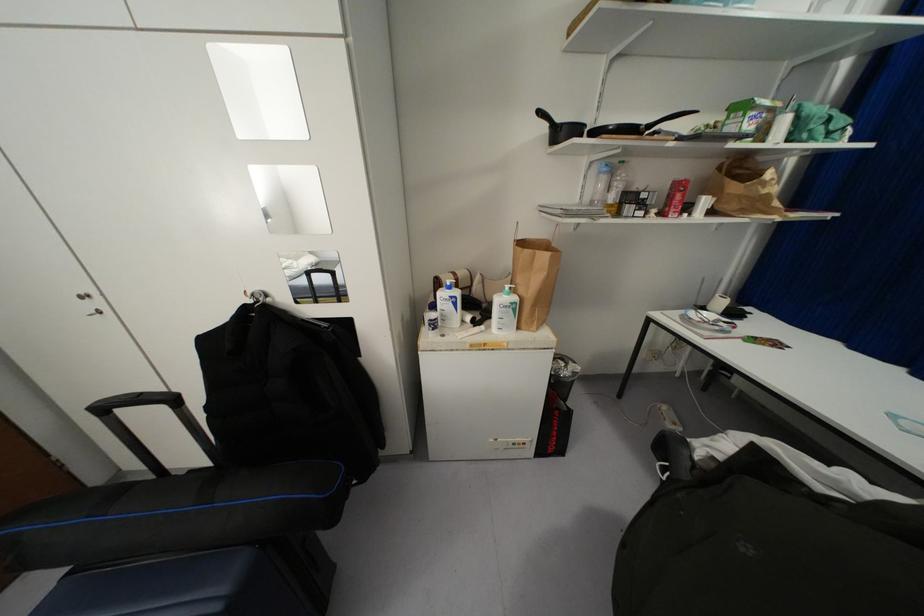
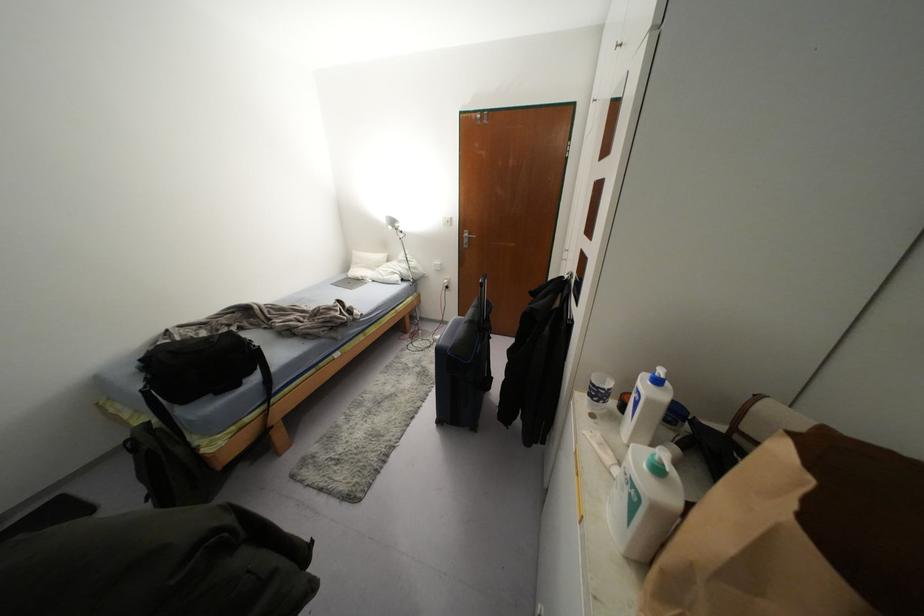
The point at (514,310) is marked in the first image. Where is the corresponding point in the second image?

(633, 505)